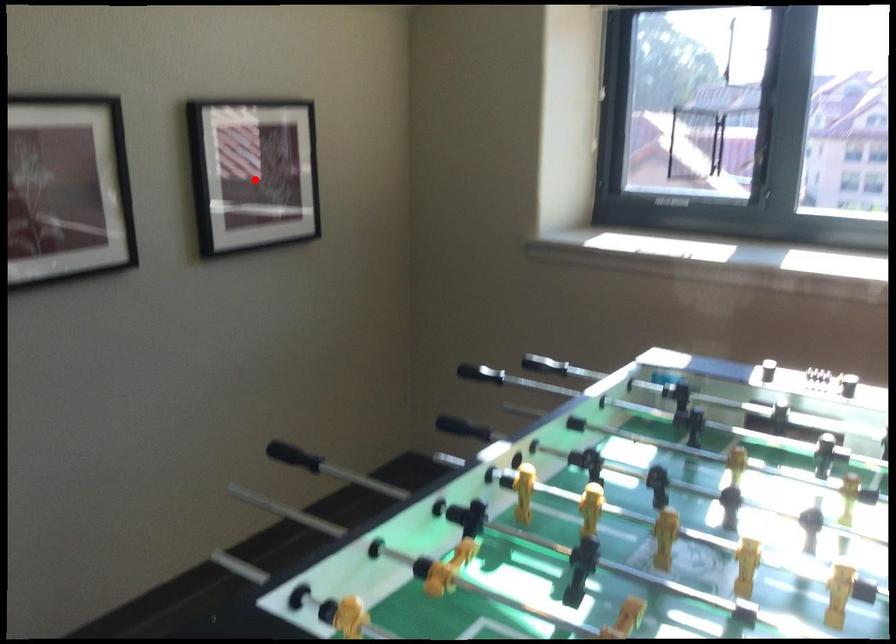
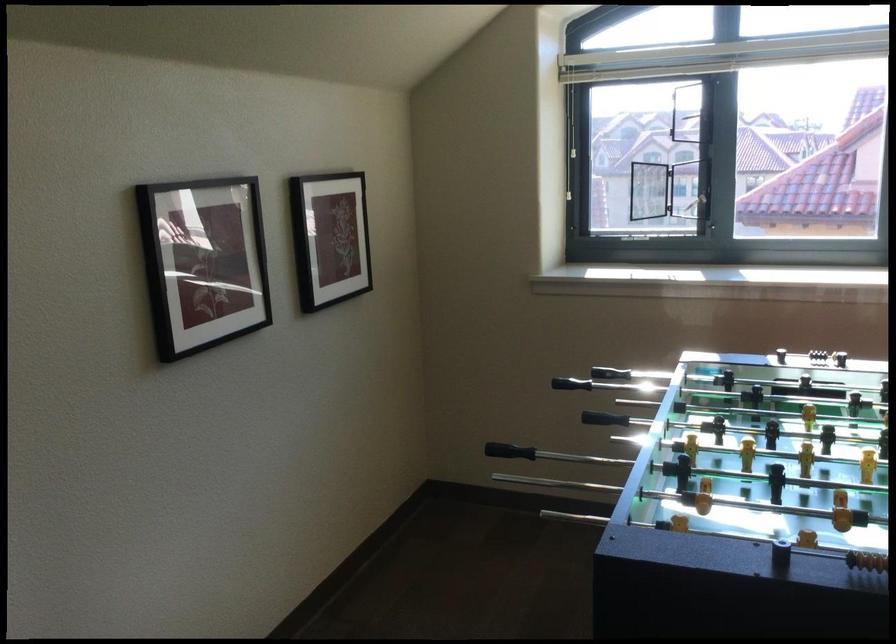
Where in the second image is the point corresponding to the highlighted location from the first image?

(330, 238)